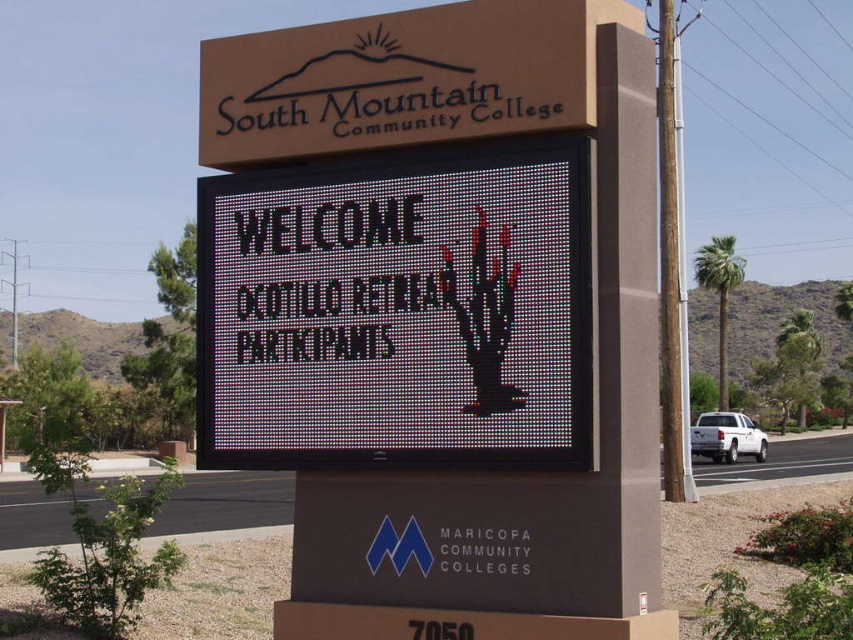
You are standing in front of the South Mountain Community College sign. Where exactly is the matte black sign at center located?

The matte black sign at center is located at point (450,308).

Based on the photo, you are a visitor approaching the entrance of South Mountain Community College. You see the matte black sign at center and the black pixelated cactus at center. Which object is located lower in the image?

The matte black sign at center is positioned under the black pixelated cactus at center, so the matte black sign at center is located lower in the image.

You are a visitor approaching the entrance of South Mountain Community College. You see the matte black sign at center and the black pixelated cactus at center. Which object is positioned to the right?

The black pixelated cactus at center is positioned to the right of the matte black sign at center.